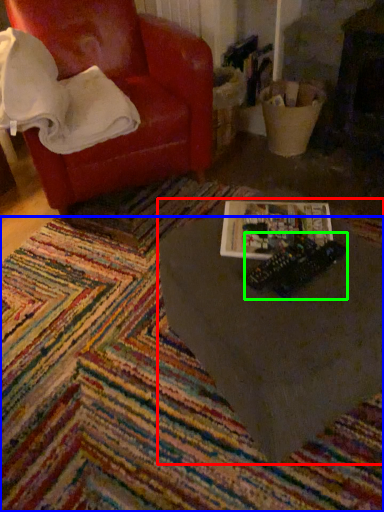
Question: Which object is the farthest from table (highlighted by a red box)? Choose among these: mat (highlighted by a blue box) or toy (highlighted by a green box).

Choices:
 (A) mat
 (B) toy

Answer: (A)